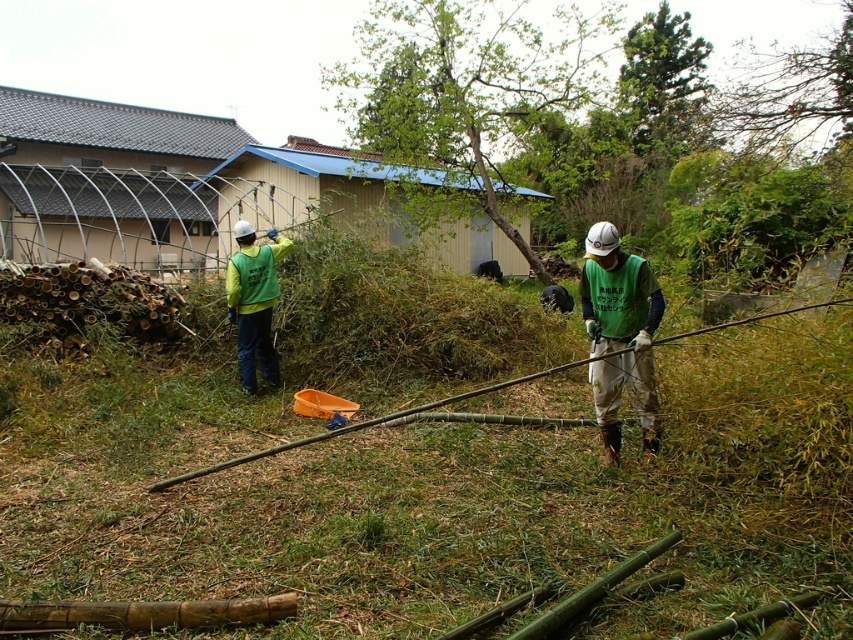
Can you confirm if green fabric vest at center is bigger than brown textured tree at upper right?

Actually, green fabric vest at center might be smaller than brown textured tree at upper right.

Who is more forward, (x=656, y=324) or (x=816, y=115)?

Positioned in front is point (x=656, y=324).

Locate an element on the screen. green fabric vest at center is located at coordinates (619, 333).

Who is higher up, green grass at center or brown textured tree at upper right?

Positioned higher is brown textured tree at upper right.

Which is in front, point (804, 326) or point (730, 88)?

Point (804, 326)

This screenshot has height=640, width=853. What are the coordinates of `green grass at center` in the screenshot? It's located at (433, 490).

Does green leafy tree at center come behind green fabric vest at center?

That is True.

Who is positioned more to the left, green leafy tree at center or green fabric vest at center?

green fabric vest at center is more to the left.

Who is more forward, (363, 76) or (590, 228)?

Point (590, 228) is more forward.

You are a GUI agent. You are given a task and a screenshot of the screen. Output one action in this format:
    pyautogui.click(x=<x>, y=<y>)
    Task: Click on the green leafy tree at center
    
    Given the screenshot: What is the action you would take?
    pyautogui.click(x=461, y=96)